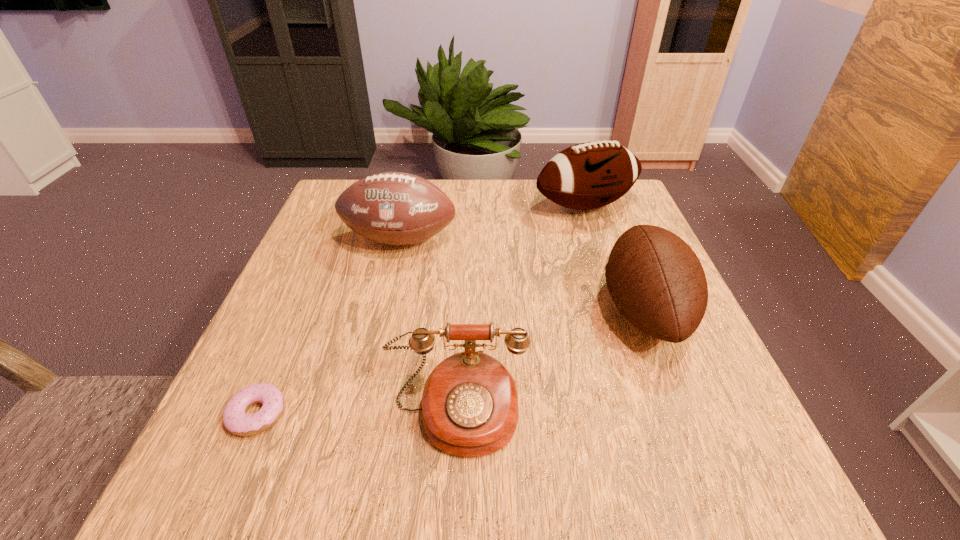
At what (x,y) coordinates should I click in order to perform the action: click on free space at the far right corner of the desktop. Please return your answer as a coordinate pair (x, y). Image resolution: width=960 pixels, height=540 pixels. Looking at the image, I should click on (621, 207).

This screenshot has height=540, width=960. What are the coordinates of `vacant space that's between the shortest object and the fourth tallest object` in the screenshot? It's located at (357, 413).

You are a GUI agent. You are given a task and a screenshot of the screen. Output one action in this format:
    pyautogui.click(x=<x>, y=<y>)
    Task: Click on the free space that is in between the doughnut and the leftmost football
    
    Given the screenshot: What is the action you would take?
    pyautogui.click(x=328, y=327)

In order to click on free space between the doughnut and the leftmost football in this screenshot , I will do `click(328, 327)`.

Identify the location of vacant area that lies between the fourth tallest object and the leftmost football. This screenshot has height=540, width=960. (428, 326).

The width and height of the screenshot is (960, 540). I want to click on vacant space that's between the telephone and the shortest object, so click(357, 413).

Select which object is the fourth closest to the fourth tallest object. Please provide its 2D coordinates. Your answer should be formatted as a tuple, i.e. [(x, y)], where the tuple contains the x and y coordinates of a point satisfying the conditions above.

[(590, 175)]

Identify which object is located as the fourth nearest to the telephone. Please provide its 2D coordinates. Your answer should be formatted as a tuple, i.e. [(x, y)], where the tuple contains the x and y coordinates of a point satisfying the conditions above.

[(590, 175)]

Identify the location of football that is the third closest to the doughnut. The height and width of the screenshot is (540, 960). (590, 175).

Find the location of `football that is the closest to the doughnut`. football that is the closest to the doughnut is located at coordinates (394, 208).